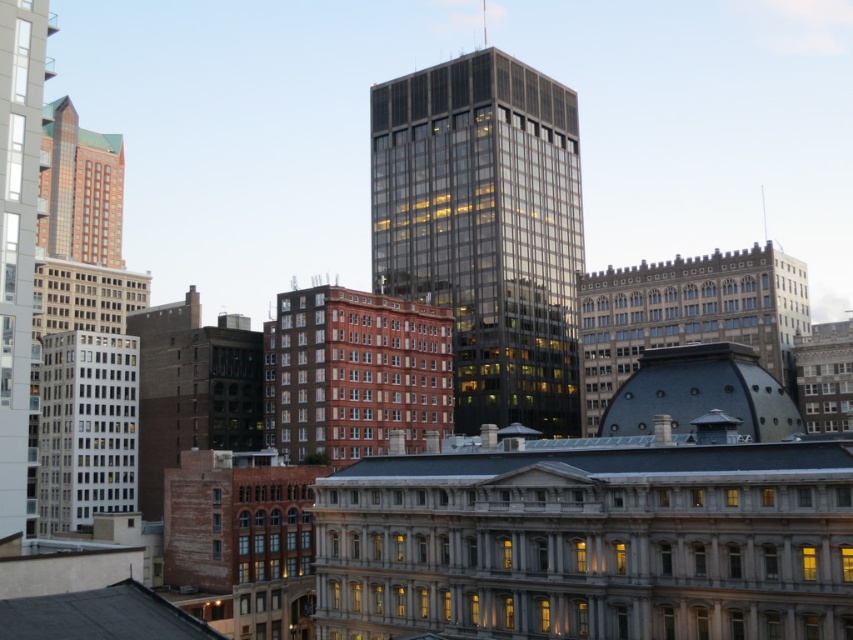
Is brown stone building at center to the right of brown brick building at center-left from the viewer's perspective?

Indeed, brown stone building at center is positioned on the right side of brown brick building at center-left.

Does brown stone building at center have a larger size compared to brown brick building at center-left?

Correct, brown stone building at center is larger in size than brown brick building at center-left.

Is point (589, 394) positioned in front of point (184, 404)?

No, it is behind (184, 404).

At what (x,y) coordinates should I click in order to perform the action: click on brown stone building at center. Please return your answer as a coordinate pair (x, y). The image size is (853, 640). Looking at the image, I should click on (688, 314).

Where is `brown brick building at center-left`? The width and height of the screenshot is (853, 640). brown brick building at center-left is located at coordinates (192, 388).

Is brown brick building at center-left thinner than white glass building at left?

Incorrect, brown brick building at center-left's width is not less than white glass building at left's.

Who is more distant from viewer, [149,368] or [86,339]?

Point [149,368]

Locate an element on the screen. brown brick building at center-left is located at coordinates (192, 388).

Can you confirm if brown brick building at center-left is wider than matte glass skyscraper at left?

Yes, brown brick building at center-left is wider than matte glass skyscraper at left.

Is brown brick building at center-left to the left of matte glass skyscraper at left from the viewer's perspective?

Yes, brown brick building at center-left is to the left of matte glass skyscraper at left.

Is point (189, 376) positioned in front of point (3, 433)?

No, (189, 376) is further to viewer.

You are a GUI agent. You are given a task and a screenshot of the screen. Output one action in this format:
    pyautogui.click(x=<x>, y=<y>)
    Task: Click on the brown brick building at center-left
    
    Given the screenshot: What is the action you would take?
    click(192, 388)